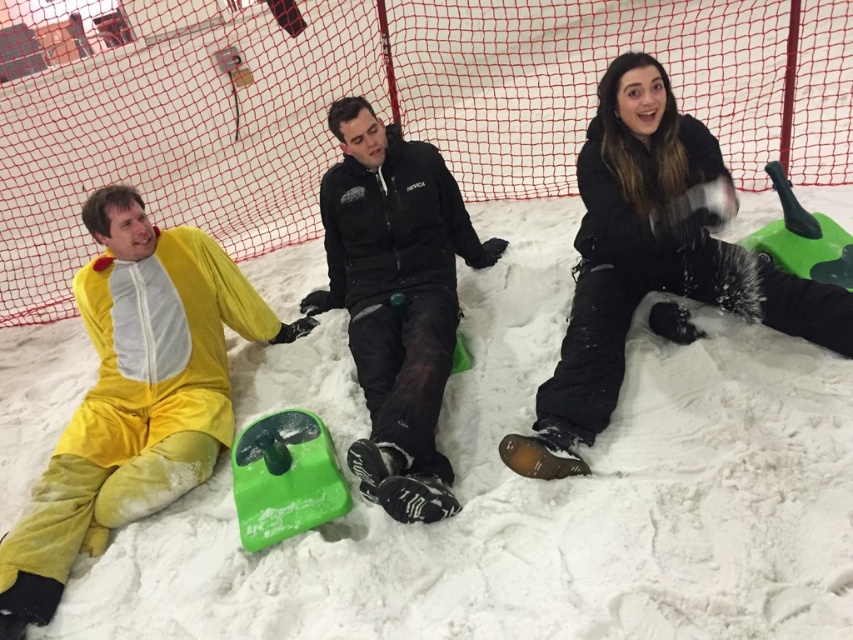
From the picture: What is located at the coordinates point (653, 259)?

The point (653, 259) is occupied by the matte black jacket at upper right.

You are standing at the entrance of the snow park and see the white fluffy snow at center and the yellow plush onesie at left. Which object is closer to you?

The white fluffy snow at center is closer to you because it is in front of the yellow plush onesie at left.